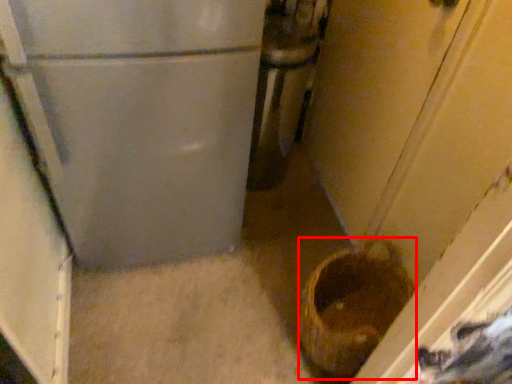
Question: From the image, what is the correct spatial relationship of basket container (annotated by the red box) in relation to appliance?

Choices:
 (A) left
 (B) right

Answer: (B)